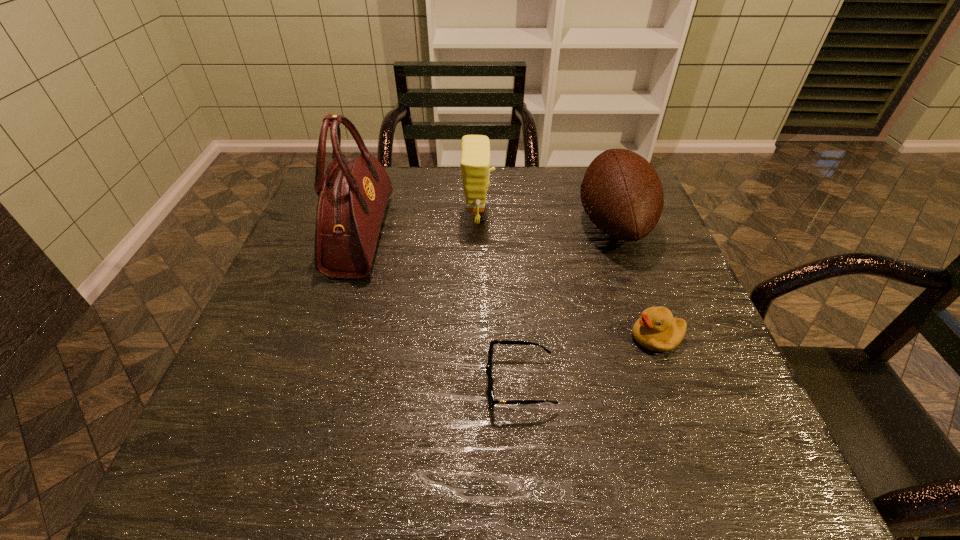
Where is `object that is at the left edge`? The image size is (960, 540). object that is at the left edge is located at coordinates click(353, 195).

Where is `football present at the right edge`? This screenshot has width=960, height=540. football present at the right edge is located at coordinates (622, 194).

Locate an element on the screen. The width and height of the screenshot is (960, 540). duckling positioned at the right edge is located at coordinates (656, 330).

Identify the location of object at the far left corner. (353, 195).

Image resolution: width=960 pixels, height=540 pixels. Identify the location of object at the far right corner. 622,194.

Locate an element on the screen. The image size is (960, 540). free space at the far edge is located at coordinates (416, 180).

This screenshot has height=540, width=960. In the image, there is a desktop. What are the coordinates of `vacant space at the near edge` in the screenshot? It's located at (375, 464).

In the image, there is a desktop. Identify the location of vacant space at the left edge. (310, 216).

You are a GUI agent. You are given a task and a screenshot of the screen. Output one action in this format:
    pyautogui.click(x=<x>, y=<y>)
    Task: Click on the vacant region at the right edge of the desktop
    The width and height of the screenshot is (960, 540).
    Given the screenshot: What is the action you would take?
    [647, 350]

This screenshot has height=540, width=960. What are the coordinates of `free spot between the shortest object and the football` in the screenshot? It's located at tap(566, 303).